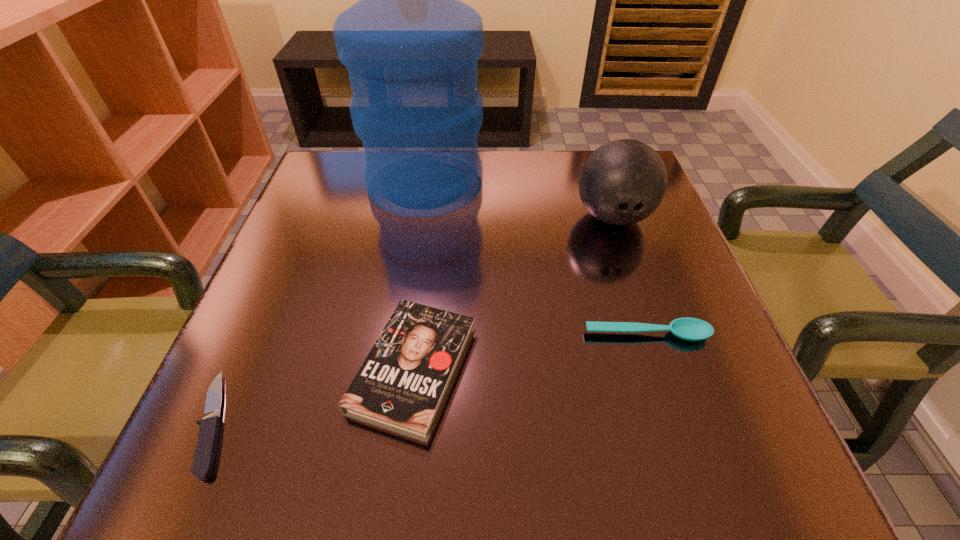
At what (x,y) coordinates should I click in order to perform the action: click on blank space located on the right of the shortest object. Please return your answer as a coordinate pair (x, y). Looking at the image, I should click on (428, 423).

I want to click on water jug present at the far edge, so click(x=411, y=47).

The width and height of the screenshot is (960, 540). What are the coordinates of `bowling ball present at the far edge` in the screenshot? It's located at (622, 182).

Where is `book that is positioned at the near edge`? This screenshot has height=540, width=960. book that is positioned at the near edge is located at coordinates (402, 385).

Locate an element on the screen. steak knife that is at the near edge is located at coordinates (207, 443).

This screenshot has height=540, width=960. Identify the location of water jug located in the left edge section of the desktop. (411, 47).

Where is `steak knife at the left edge`? steak knife at the left edge is located at coordinates (207, 443).

Image resolution: width=960 pixels, height=540 pixels. I want to click on bowling ball that is at the right edge, so click(622, 182).

Find the location of `spoon that is at the right edge`. spoon that is at the right edge is located at coordinates (692, 329).

Find the location of `object present at the far left corner`. object present at the far left corner is located at coordinates (411, 47).